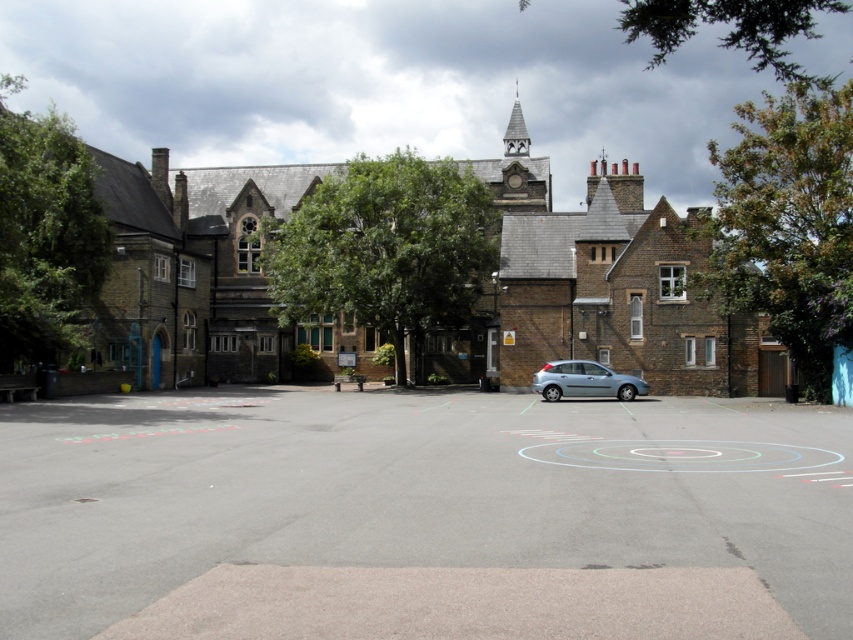
Find the location of a particular element. gray asphalt parking lot at center is located at coordinates (422, 515).

The image size is (853, 640). What do you see at coordinates (422, 515) in the screenshot? I see `gray asphalt parking lot at center` at bounding box center [422, 515].

At what (x,y) coordinates should I click in order to perform the action: click on gray asphalt parking lot at center. Please return your answer as a coordinate pair (x, y). The width and height of the screenshot is (853, 640). Looking at the image, I should click on (422, 515).

Between gray asphalt parking lot at center and wooden spire at upper center, which one appears on the left side from the viewer's perspective?

gray asphalt parking lot at center is more to the left.

Can you confirm if gray asphalt parking lot at center is taller than wooden spire at upper center?

In fact, gray asphalt parking lot at center may be shorter than wooden spire at upper center.

Where is `gray asphalt parking lot at center`? The height and width of the screenshot is (640, 853). gray asphalt parking lot at center is located at coordinates (422, 515).

Between point (546, 364) and point (509, 134), which one is positioned behind?

The point (509, 134) is more distant.

Does satin silver car at center appear over wooden spire at upper center?

No, satin silver car at center is not above wooden spire at upper center.

The width and height of the screenshot is (853, 640). What do you see at coordinates (584, 381) in the screenshot? I see `satin silver car at center` at bounding box center [584, 381].

The image size is (853, 640). What are the coordinates of `satin silver car at center` in the screenshot? It's located at (584, 381).